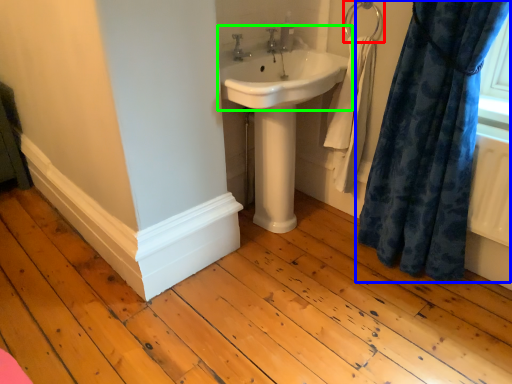
Question: Which is farther away from towel bar (highlighted by a red box)? curtain (highlighted by a blue box) or sink (highlighted by a green box)?

Choices:
 (A) curtain
 (B) sink

Answer: (A)